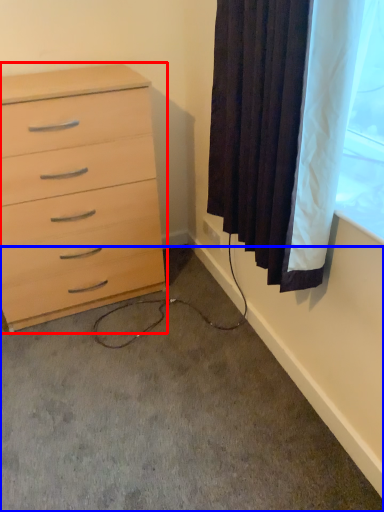
Question: Among these objects, which one is nearest to the camera, chest of drawers (highlighted by a red box) or concrete (highlighted by a blue box)?

Choices:
 (A) chest of drawers
 (B) concrete

Answer: (B)